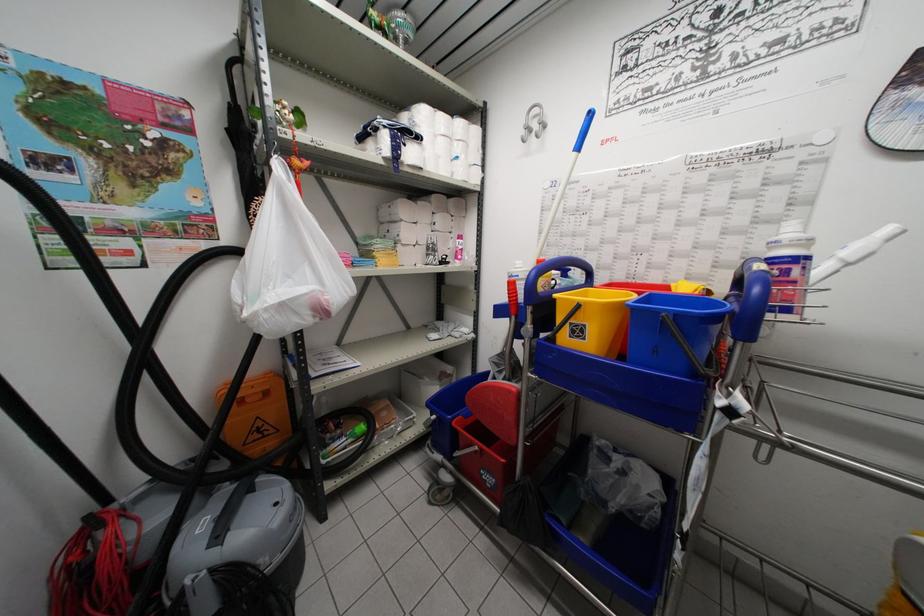
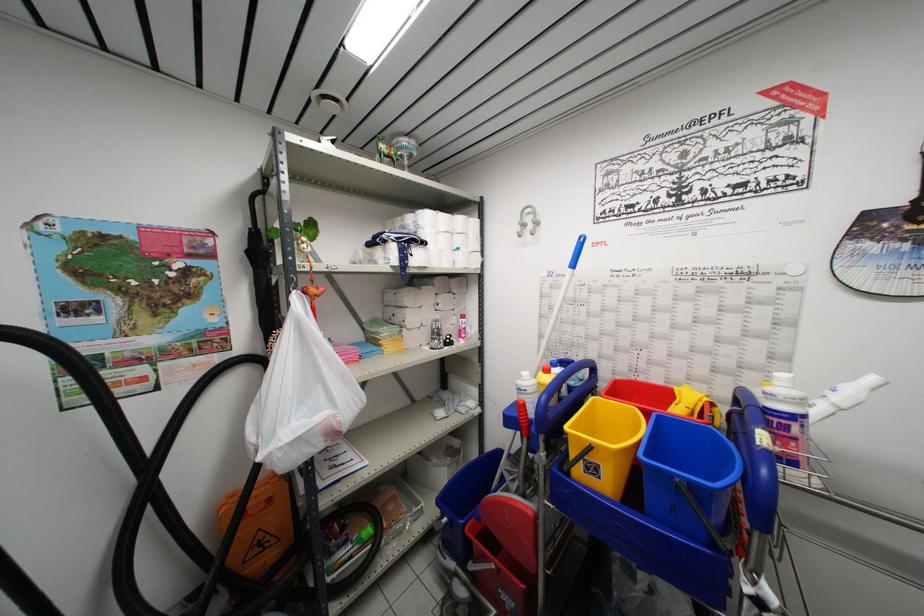
In the second image, find the point that corresponds to point 574,341 in the first image.

(589, 477)